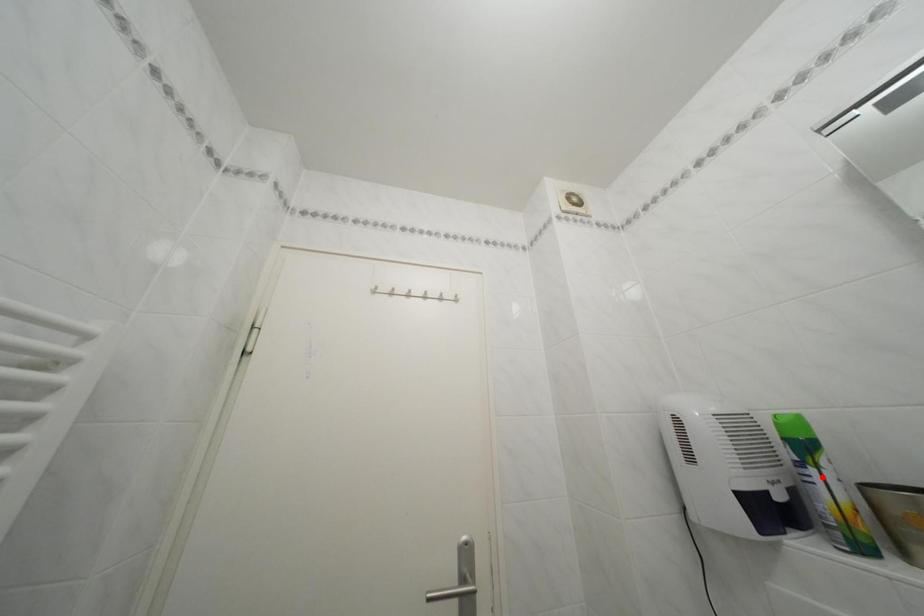
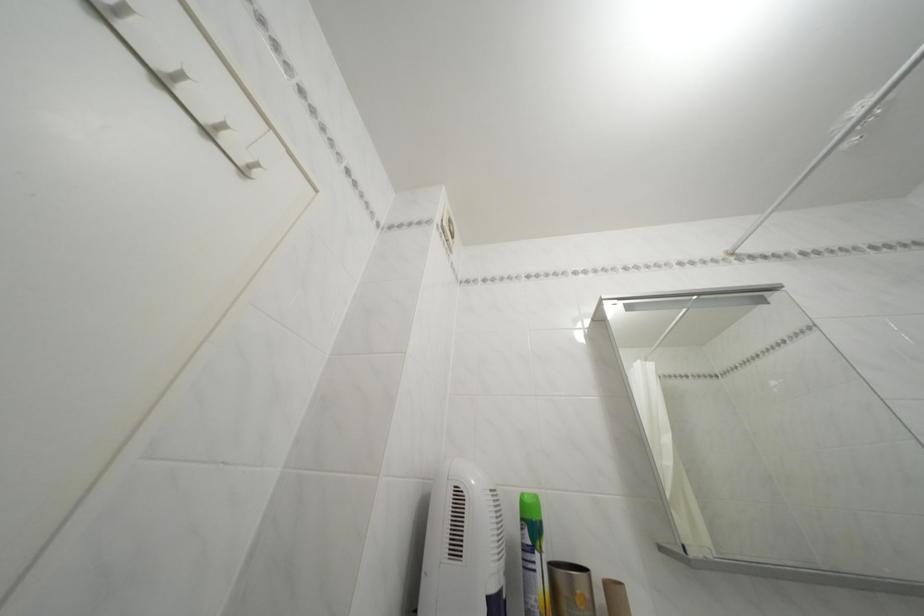
In the second image, find the point that corresponds to the highlighted location in the first image.

(545, 562)